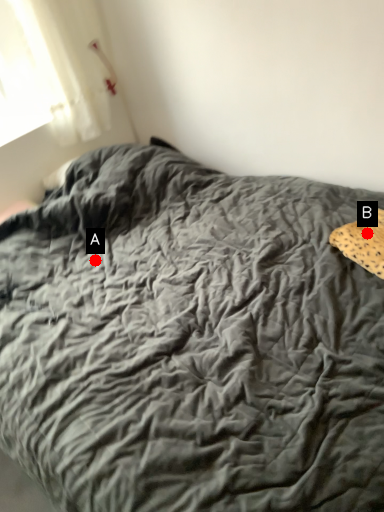
Question: Two points are circled on the image, labeled by A and B beside each circle. Which point is further to the camera?

Choices:
 (A) A is further
 (B) B is further

Answer: (A)